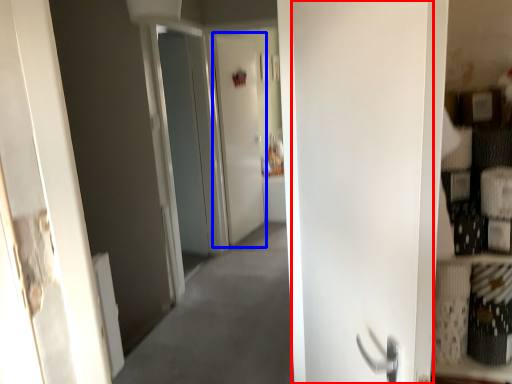
Question: Which object appears farthest to the camera in this image, door (highlighted by a red box) or screen door (highlighted by a blue box)?

Choices:
 (A) door
 (B) screen door

Answer: (B)